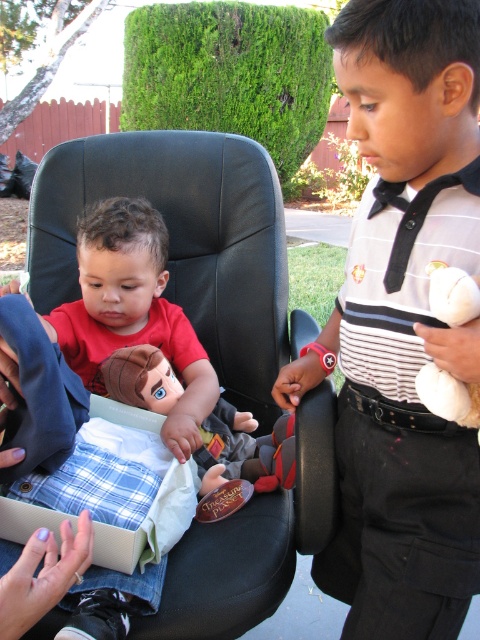
You are a photographer trying to capture the white striped shirt at center in the image. Based on the coordinates provided, where should you focus your camera to ensure the shirt is in the center of the frame?

To capture the white striped shirt at center, focus your camera at the coordinates point (403, 323) as specified in the description.

Based on the photo, you are a photographer setting up a shoot in the described scene. You need to position a light source to illuminate the white striped shirt at center and the black leather armchair at center. Since the shirt is below the chair, where should you place the light to ensure both are well lit?

The white striped shirt at center is located below the black leather armchair at center. To ensure both are well lit, position the light source above the black leather armchair at center so that the light can reach both the chair and the shirt below it.